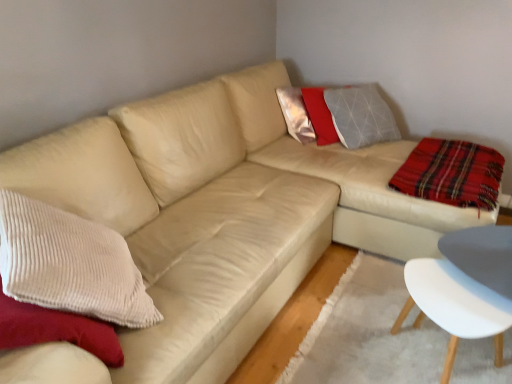
What do you see at coordinates (451, 173) in the screenshot? I see `plaid fabric at right` at bounding box center [451, 173].

In order to click on plaid fabric at right in this screenshot , I will do `click(451, 173)`.

Based on the photo, measure the distance between point (490, 182) and camera.

Point (490, 182) is 6.86 feet from camera.

Describe the element at coordinates (455, 306) in the screenshot. I see `white plastic chair at lower right` at that location.

This screenshot has height=384, width=512. I want to click on white plastic chair at lower right, so click(455, 306).

The width and height of the screenshot is (512, 384). Find the location of `plaid fabric at right`. plaid fabric at right is located at coordinates (451, 173).

Is white plastic chair at lower right at the right side of plaid fabric at right?

No.

Looking at this image, which is behind, white plastic chair at lower right or plaid fabric at right?

plaid fabric at right is further from the camera.

Considering the positions of point (482, 291) and point (440, 168), is point (482, 291) closer or farther from the camera than point (440, 168)?

Point (482, 291) is closer to the camera than point (440, 168).

From the image's perspective, which object appears higher, white plastic chair at lower right or plaid fabric at right?

plaid fabric at right, from the image's perspective.

From the picture: From a real-world perspective, which is physically above, white plastic chair at lower right or plaid fabric at right?

plaid fabric at right.

Considering the sizes of objects white plastic chair at lower right and plaid fabric at right in the image provided, who is wider, white plastic chair at lower right or plaid fabric at right?

With larger width is plaid fabric at right.

Considering the sizes of white plastic chair at lower right and plaid fabric at right in the image, is white plastic chair at lower right taller or shorter than plaid fabric at right?

In the image, white plastic chair at lower right appears to be taller than plaid fabric at right.

Who is bigger, white plastic chair at lower right or plaid fabric at right?

white plastic chair at lower right is bigger.

Can plaid fabric at right be found inside white plastic chair at lower right?

No, plaid fabric at right is not inside white plastic chair at lower right.

Does white plastic chair at lower right touch plaid fabric at right?

No, white plastic chair at lower right is not touching plaid fabric at right.

In the scene shown: Is white plastic chair at lower right aimed at plaid fabric at right?

No.

Can you tell me how much white plastic chair at lower right and plaid fabric at right differ in facing direction?

white plastic chair at lower right and plaid fabric at right are facing 3.69 degrees away from each other.

Where is `chair below the plaid fabric at right (from the image's perspective)`? This screenshot has height=384, width=512. chair below the plaid fabric at right (from the image's perspective) is located at coordinates (455, 306).

In the image, is plaid fabric at right on the left side or the right side of white plastic chair at lower right?

In the image, plaid fabric at right appears on the right side of white plastic chair at lower right.

In the image, is plaid fabric at right positioned in front of or behind white plastic chair at lower right?

plaid fabric at right is behind white plastic chair at lower right.

Is point (450, 182) closer to camera compared to point (502, 301)?

No, (450, 182) is behind (502, 301).

In the scene shown: From the image's perspective, is plaid fabric at right on top of white plastic chair at lower right?

Yes, from the image's perspective, plaid fabric at right is above white plastic chair at lower right.

From a real-world perspective, is plaid fabric at right positioned under white plastic chair at lower right based on gravity?

No.

Which of these two, plaid fabric at right or white plastic chair at lower right, is thinner?

white plastic chair at lower right is thinner.

Considering the relative sizes of plaid fabric at right and white plastic chair at lower right in the image provided, is plaid fabric at right shorter than white plastic chair at lower right?

Correct, plaid fabric at right is not as tall as white plastic chair at lower right.

Considering the sizes of objects plaid fabric at right and white plastic chair at lower right in the image provided, who is bigger, plaid fabric at right or white plastic chair at lower right?

white plastic chair at lower right is bigger.

Is plaid fabric at right not inside white plastic chair at lower right?

Yes, plaid fabric at right is outside of white plastic chair at lower right.

Are plaid fabric at right and white plastic chair at lower right making contact?

There is a gap between plaid fabric at right and white plastic chair at lower right.

Is white plastic chair at lower right at the back of plaid fabric at right?

No, plaid fabric at right is not facing away from white plastic chair at lower right.

What's the angular difference between plaid fabric at right and white plastic chair at lower right's facing directions?

plaid fabric at right and white plastic chair at lower right are facing 3.69 degrees away from each other.

How far apart are plaid fabric at right and white plastic chair at lower right?

plaid fabric at right is 28.16 inches from white plastic chair at lower right.

In the image, there is a white plastic chair at lower right. At what (x,y) coordinates should I click in order to perform the action: click on plaid above it (from the image's perspective). Please return your answer as a coordinate pair (x, y). The image size is (512, 384). Looking at the image, I should click on (451, 173).

This screenshot has width=512, height=384. In order to click on plaid lying on the right of white plastic chair at lower right in this screenshot , I will do `click(451, 173)`.

The width and height of the screenshot is (512, 384). What are the coordinates of `plaid behind the white plastic chair at lower right` in the screenshot? It's located at (451, 173).